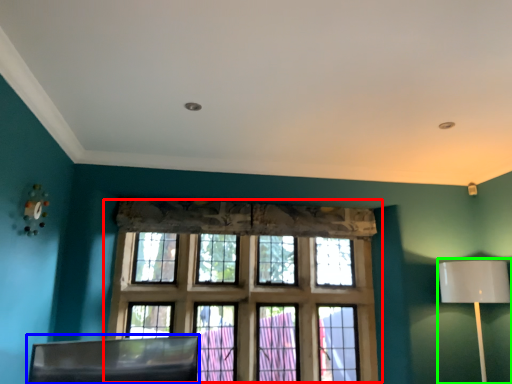
Question: Based on their relative distances, which object is nearer to window (highlighted by a red box)? Choose from swivel chair (highlighted by a blue box) and table lamp (highlighted by a green box).

Choices:
 (A) swivel chair
 (B) table lamp

Answer: (A)